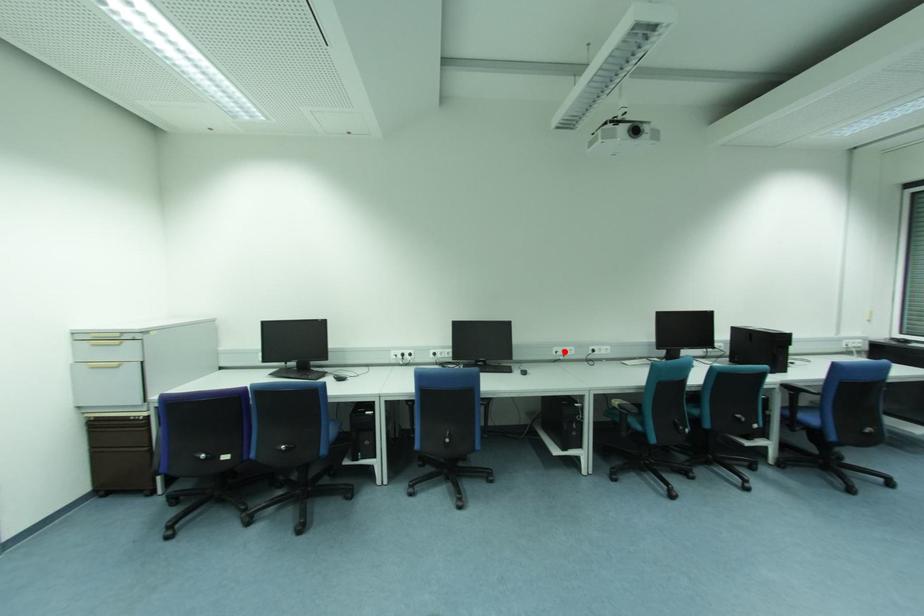
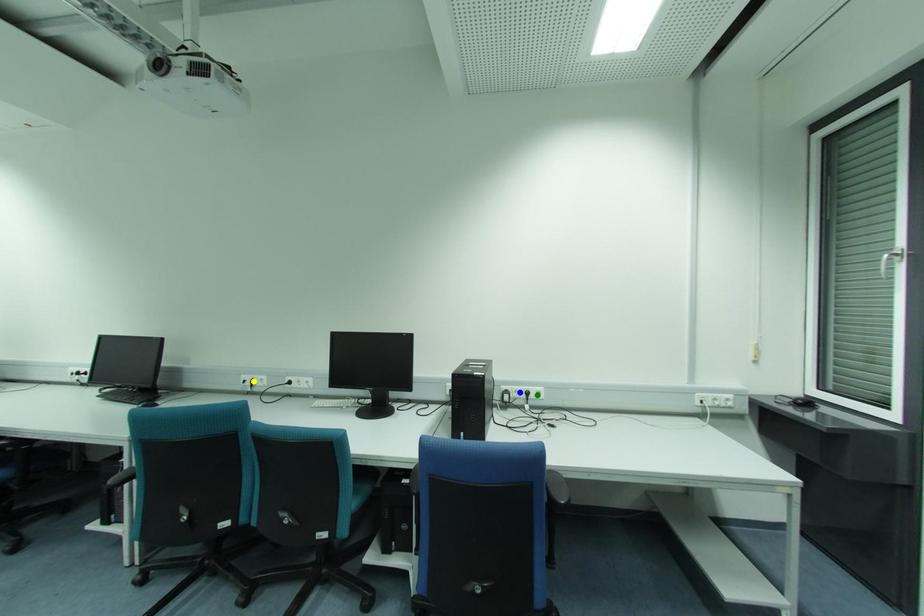
Question: I am providing you with two images of the same scene from different viewpoints. A red point is marked on the first image. You are given multiple points on the second image. In image 2, which mark is for the same physical point as the one in image 1?

Choices:
 (A) green point
 (B) yellow point
 (C) blue point

Answer: (B)